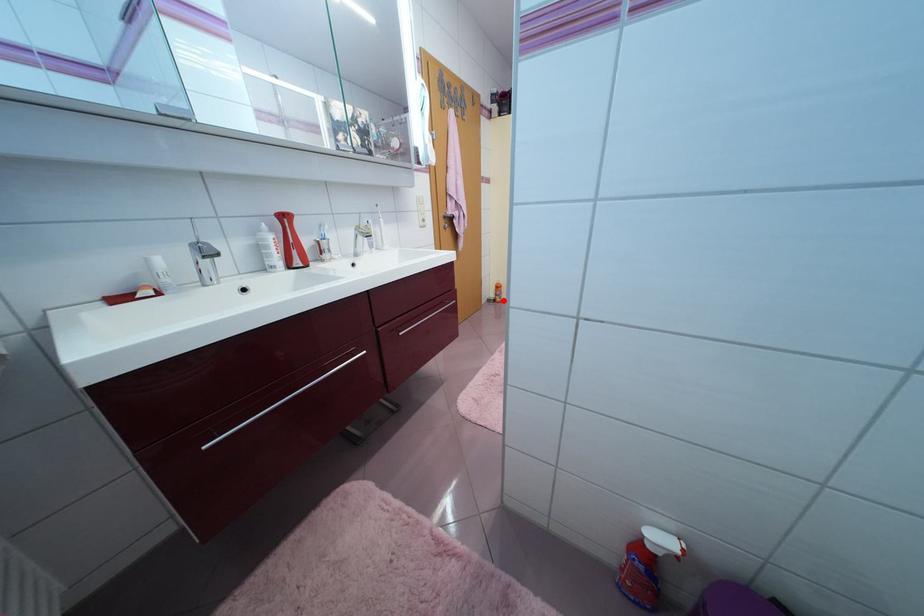
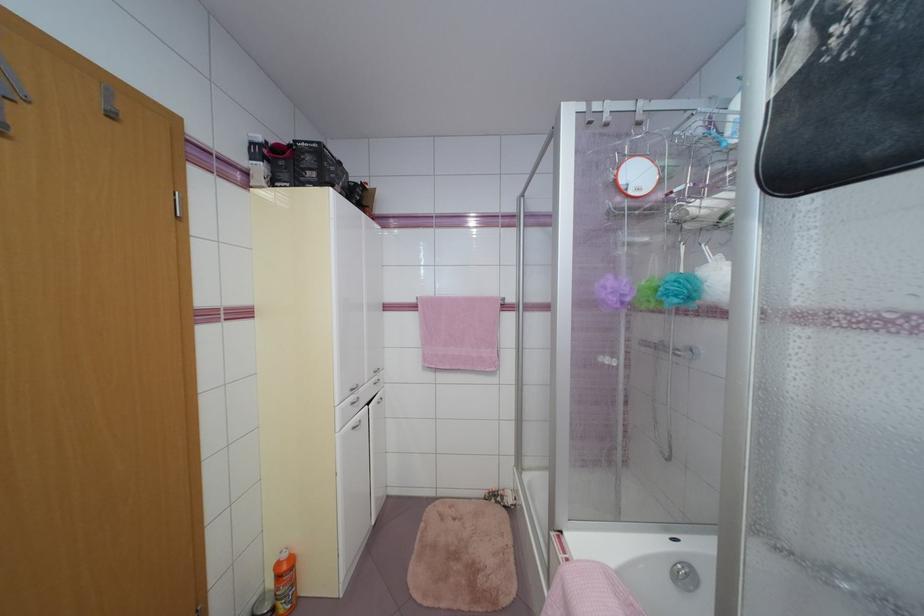
The point at the highlighted location is marked in the first image. Where is the corresponding point in the second image?

(287, 610)